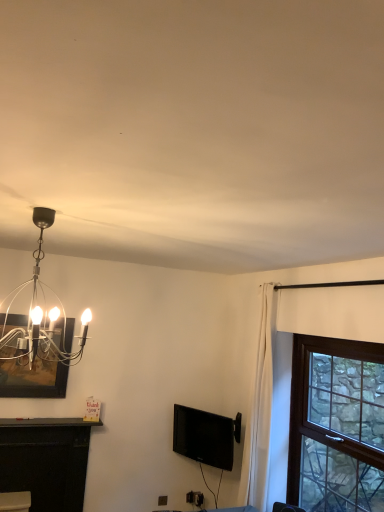
What is the approximate width of polished silver chandelier at upper left?

The width of polished silver chandelier at upper left is 50.68 centimeters.

Image resolution: width=384 pixels, height=512 pixels. What are the coordinates of `matte black picture frame at upper left` in the screenshot? It's located at (33, 378).

Is matte black picture frame at upper left beside polished silver chandelier at upper left?

matte black picture frame at upper left and polished silver chandelier at upper left are not in contact.

From the image's perspective, which is above, matte black picture frame at upper left or polished silver chandelier at upper left?

polished silver chandelier at upper left appears higher in the image.

Looking at their sizes, would you say matte black picture frame at upper left is wider or thinner than polished silver chandelier at upper left?

matte black picture frame at upper left is thinner than polished silver chandelier at upper left.

Can you confirm if brown wooden window at right is wider than polished silver chandelier at upper left?

In fact, brown wooden window at right might be narrower than polished silver chandelier at upper left.

Considering the points (331, 340) and (9, 340), which point is in front, point (331, 340) or point (9, 340)?

Positioned in front is point (9, 340).

Does brown wooden window at right lie behind polished silver chandelier at upper left?

Yes, brown wooden window at right is behind polished silver chandelier at upper left.

How distant is brown wooden window at right from polished silver chandelier at upper left?

They are 6.93 feet apart.

In the image, there is a black matte fireplace at lower left. Identify the location of window above it (from the image's perspective). The image size is (384, 512). (336, 425).

Considering the relative sizes of black matte fireplace at lower left and brown wooden window at right in the image provided, is black matte fireplace at lower left smaller than brown wooden window at right?

Indeed, black matte fireplace at lower left has a smaller size compared to brown wooden window at right.

From a real-world perspective, is black matte fireplace at lower left positioned over brown wooden window at right based on gravity?

No, from a real-world perspective, black matte fireplace at lower left is not on top of brown wooden window at right.

Is black matte fireplace at lower left thinner than brown wooden window at right?

No, black matte fireplace at lower left is not thinner than brown wooden window at right.

Who is smaller, black glossy tv at center or brown wooden window at right?

black glossy tv at center is smaller.

Is black glossy tv at center far away from brown wooden window at right?

black glossy tv at center is actually quite close to brown wooden window at right.

Is the depth of black glossy tv at center less than that of brown wooden window at right?

No, it is not.

Based on the photo, can we say black glossy tv at center lies outside brown wooden window at right?

Yes.

The width and height of the screenshot is (384, 512). There is a black matte fireplace at lower left. In order to click on television above it (from a real-world perspective) in this screenshot , I will do click(x=205, y=436).

Which is behind, black glossy tv at center or black matte fireplace at lower left?

black glossy tv at center.

In the scene shown: Is black glossy tv at center turned away from black matte fireplace at lower left?

No, black glossy tv at center is not facing the opposite direction of black matte fireplace at lower left.

From the image's perspective, is black glossy tv at center under black matte fireplace at lower left?

No, from the image's perspective, black glossy tv at center is not below black matte fireplace at lower left.

What's the angular difference between black glossy tv at center and polished silver chandelier at upper left's facing directions?

153 degrees separate the facing orientations of black glossy tv at center and polished silver chandelier at upper left.

Is polished silver chandelier at upper left completely or partially inside black glossy tv at center?

That's incorrect, polished silver chandelier at upper left is not inside black glossy tv at center.

Based on the photo, considering the positions of objects black glossy tv at center and polished silver chandelier at upper left in the image provided, who is more to the left, black glossy tv at center or polished silver chandelier at upper left?

polished silver chandelier at upper left is more to the left.

In terms of width, does black glossy tv at center look wider or thinner when compared to polished silver chandelier at upper left?

In the image, black glossy tv at center appears to be more narrow than polished silver chandelier at upper left.

Between point (339, 386) and point (23, 321), which one is positioned in front?

The point (23, 321) is more forward.

Does brown wooden window at right have a lesser height compared to matte black picture frame at upper left?

No.

Between brown wooden window at right and matte black picture frame at upper left, which one is positioned in front?

brown wooden window at right.

From a real-world perspective, who is located lower, brown wooden window at right or matte black picture frame at upper left?

brown wooden window at right.

The image size is (384, 512). Identify the location of picture frame behind the polished silver chandelier at upper left. (33, 378).

The image size is (384, 512). Identify the location of window on the right of polished silver chandelier at upper left. (336, 425).

Estimate the real-world distances between objects in this image. Which object is further from matte black picture frame at upper left, brown wooden window at right or black matte fireplace at lower left?

brown wooden window at right.

When comparing their distances from matte black picture frame at upper left, does black glossy tv at center or black matte fireplace at lower left seem closer?

black matte fireplace at lower left is positioned closer to the anchor matte black picture frame at upper left.

Based on their spatial positions, is matte black picture frame at upper left or black matte fireplace at lower left closer to brown wooden window at right?

black matte fireplace at lower left lies closer to brown wooden window at right than the other object.

From the picture: When comparing their distances from polished silver chandelier at upper left, does black matte fireplace at lower left or brown wooden window at right seem closer?

black matte fireplace at lower left is closer to polished silver chandelier at upper left.

When comparing their distances from black matte fireplace at lower left, does brown wooden window at right or polished silver chandelier at upper left seem closer?

Based on the image, polished silver chandelier at upper left appears to be nearer to black matte fireplace at lower left.

From the picture: When comparing their distances from black glossy tv at center, does polished silver chandelier at upper left or brown wooden window at right seem further?

Answer: Among the two, polished silver chandelier at upper left is located further to black glossy tv at center.

When comparing their distances from polished silver chandelier at upper left, does black glossy tv at center or black matte fireplace at lower left seem further?

The object further to polished silver chandelier at upper left is black glossy tv at center.

Estimate the real-world distances between objects in this image. Which object is closer to black matte fireplace at lower left, black glossy tv at center or matte black picture frame at upper left?

matte black picture frame at upper left.

The width and height of the screenshot is (384, 512). What are the coordinates of `television located between matte black picture frame at upper left and brown wooden window at right in the left-right direction` in the screenshot? It's located at (205, 436).

This screenshot has height=512, width=384. I want to click on picture frame between polished silver chandelier at upper left and black glossy tv at center in the front-back direction, so click(33, 378).

Locate an element on the screen. table located between matte black picture frame at upper left and black glossy tv at center in the left-right direction is located at coordinates (46, 461).

Find the location of a particular element. The image size is (384, 512). table between polished silver chandelier at upper left and black glossy tv at center from front to back is located at coordinates (46, 461).